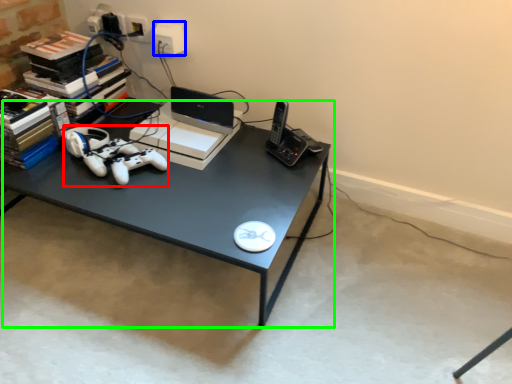
Question: Which object is the farthest from game controller (highlighted by a red box)? Choose among these: electric outlet (highlighted by a blue box) or desk (highlighted by a green box).

Choices:
 (A) electric outlet
 (B) desk

Answer: (A)